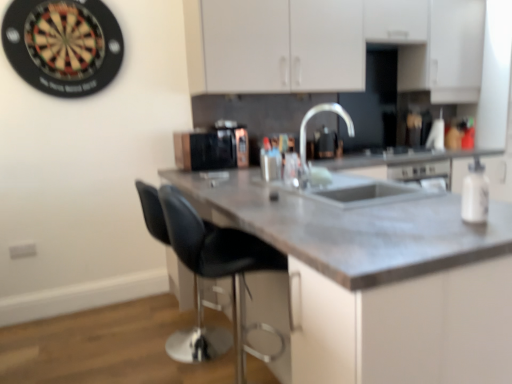
Question: Does satin nickel faucet at center have a lesser height compared to white matte cabinet at upper center?

Choices:
 (A) no
 (B) yes

Answer: (B)

Question: Does satin nickel faucet at center have a larger size compared to white matte cabinet at upper center?

Choices:
 (A) yes
 (B) no

Answer: (B)

Question: Is satin nickel faucet at center surrounding white matte cabinet at upper center?

Choices:
 (A) no
 (B) yes

Answer: (A)

Question: Is satin nickel faucet at center to the right of white matte cabinet at upper center from the viewer's perspective?

Choices:
 (A) yes
 (B) no

Answer: (B)

Question: Are satin nickel faucet at center and white matte cabinet at upper center making contact?

Choices:
 (A) yes
 (B) no

Answer: (B)

Question: Considering the relative positions of satin nickel faucet at center and white matte cabinet at upper center in the image provided, is satin nickel faucet at center to the left of white matte cabinet at upper center from the viewer's perspective?

Choices:
 (A) yes
 (B) no

Answer: (A)

Question: Is matte gray countertop at center at the left side of black leather stool at center?

Choices:
 (A) no
 (B) yes

Answer: (A)

Question: Can you confirm if matte gray countertop at center is smaller than black leather stool at center?

Choices:
 (A) yes
 (B) no

Answer: (B)

Question: From the image's perspective, is matte gray countertop at center over black leather stool at center?

Choices:
 (A) no
 (B) yes

Answer: (B)

Question: Is matte gray countertop at center further to camera compared to black leather stool at center?

Choices:
 (A) yes
 (B) no

Answer: (B)

Question: Is matte gray countertop at center facing away from black leather stool at center?

Choices:
 (A) yes
 (B) no

Answer: (A)

Question: From the image's perspective, is matte gray countertop at center below black leather stool at center?

Choices:
 (A) yes
 (B) no

Answer: (B)

Question: Does white matte cabinet at upper center contain black leather stool at center?

Choices:
 (A) yes
 (B) no

Answer: (B)